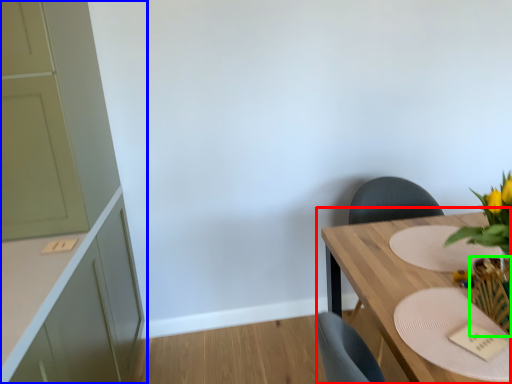
Question: Considering the real-world distances, which object is closest to table (highlighted by a red box)? cabinetry (highlighted by a blue box) or vase (highlighted by a green box).

Choices:
 (A) cabinetry
 (B) vase

Answer: (B)